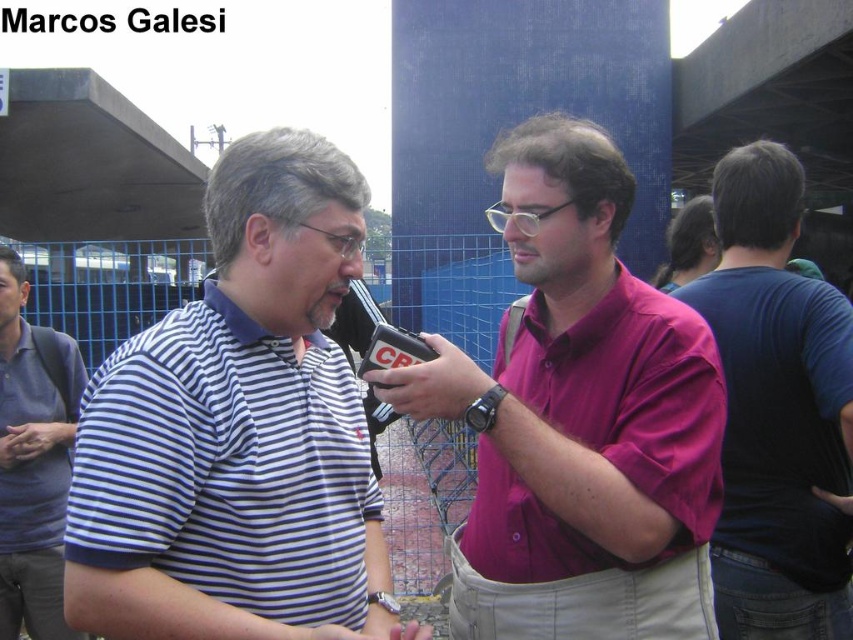
Question: Which object appears closest to the camera in this image?

Choices:
 (A) dark blue t-shirt at right
 (B) matte pink shirt at center
 (C) blue striped polo shirt at left
 (D) blue striped shirt at center

Answer: (D)

Question: Can you confirm if blue striped shirt at center is thinner than dark blue t-shirt at right?

Choices:
 (A) no
 (B) yes

Answer: (A)

Question: Among these objects, which one is nearest to the camera?

Choices:
 (A) blue striped shirt at center
 (B) blue striped polo shirt at left
 (C) matte pink shirt at center
 (D) dark blue t-shirt at right

Answer: (A)

Question: Does dark blue t-shirt at right come behind blue striped polo shirt at left?

Choices:
 (A) yes
 (B) no

Answer: (B)

Question: Is blue striped shirt at center above blue striped polo shirt at left?

Choices:
 (A) yes
 (B) no

Answer: (A)

Question: Which object is farther from the camera taking this photo?

Choices:
 (A) blue striped shirt at center
 (B) dark blue t-shirt at right
 (C) blue striped polo shirt at left

Answer: (C)